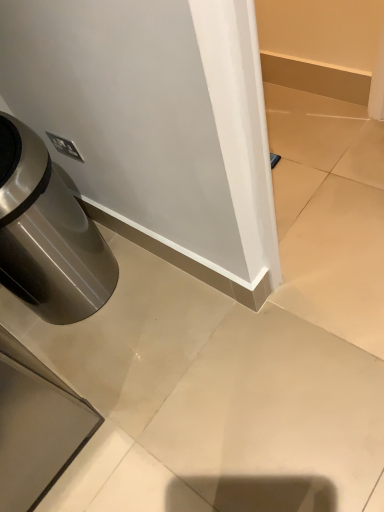
Image resolution: width=384 pixels, height=512 pixels. I want to click on white glossy baseboard at center, so click(275, 417).

What do you see at coordinates (275, 417) in the screenshot? I see `white glossy baseboard at center` at bounding box center [275, 417].

You are a GUI agent. You are given a task and a screenshot of the screen. Output one action in this format:
    pyautogui.click(x=<x>, y=<y>)
    Task: Click on the brushed metal trash can at lower left
    This screenshot has width=384, height=512.
    Given the screenshot: What is the action you would take?
    pyautogui.click(x=47, y=234)

The width and height of the screenshot is (384, 512). What do you see at coordinates (47, 234) in the screenshot?
I see `brushed metal trash can at lower left` at bounding box center [47, 234].

What is the approximate height of brushed metal trash can at lower left?

brushed metal trash can at lower left is 28.39 inches in height.

At what (x,y) coordinates should I click in order to perform the action: click on white glossy baseboard at center. Please return your answer as a coordinate pair (x, y). Looking at the image, I should click on (275, 417).

Which object is positioned more to the right, brushed metal trash can at lower left or white glossy baseboard at center?

white glossy baseboard at center is more to the right.

Is brushed metal trash can at lower left in front of or behind white glossy baseboard at center in the image?

Clearly, brushed metal trash can at lower left is behind white glossy baseboard at center.

Considering the points (98, 284) and (322, 490), which point is in front, point (98, 284) or point (322, 490)?

The point (322, 490) is closer to the camera.

From the image's perspective, which is above, brushed metal trash can at lower left or white glossy baseboard at center?

brushed metal trash can at lower left appears higher in the image.

From a real-world perspective, is brushed metal trash can at lower left physically below white glossy baseboard at center?

No, from a real-world perspective, brushed metal trash can at lower left is not below white glossy baseboard at center.

Considering the sizes of objects brushed metal trash can at lower left and white glossy baseboard at center in the image provided, who is wider, brushed metal trash can at lower left or white glossy baseboard at center?

white glossy baseboard at center is wider.

From the picture: Considering the sizes of brushed metal trash can at lower left and white glossy baseboard at center in the image, is brushed metal trash can at lower left taller or shorter than white glossy baseboard at center?

In the image, brushed metal trash can at lower left appears to be taller than white glossy baseboard at center.

In the scene shown: Does brushed metal trash can at lower left have a smaller size compared to white glossy baseboard at center?

No.

Is white glossy baseboard at center surrounded by brushed metal trash can at lower left?

Definitely not — white glossy baseboard at center is not inside brushed metal trash can at lower left.

Is the surface of brushed metal trash can at lower left in direct contact with white glossy baseboard at center?

They are not placed beside each other.

Is brushed metal trash can at lower left positioned with its back to white glossy baseboard at center?

brushed metal trash can at lower left is not turned away from white glossy baseboard at center.

What's the angular difference between brushed metal trash can at lower left and white glossy baseboard at center's facing directions?

There is a 180-degree angle between the facing directions of brushed metal trash can at lower left and white glossy baseboard at center.

You are a GUI agent. You are given a task and a screenshot of the screen. Output one action in this format:
    pyautogui.click(x=<x>, y=<y>)
    Task: Click on the concrete on the right of brushed metal trash can at lower left
    This screenshot has width=384, height=512.
    Given the screenshot: What is the action you would take?
    pyautogui.click(x=275, y=417)

Which is more to the left, white glossy baseboard at center or brushed metal trash can at lower left?

From the viewer's perspective, brushed metal trash can at lower left appears more on the left side.

Considering the relative positions of white glossy baseboard at center and brushed metal trash can at lower left in the image provided, is white glossy baseboard at center behind brushed metal trash can at lower left?

No.

Does point (366, 393) come closer to viewer compared to point (41, 274)?

Yes, point (366, 393) is closer to viewer.

From the image's perspective, would you say white glossy baseboard at center is shown under brushed metal trash can at lower left?

Yes, from the image's perspective, white glossy baseboard at center is below brushed metal trash can at lower left.

From a real-world perspective, who is located lower, white glossy baseboard at center or brushed metal trash can at lower left?

white glossy baseboard at center, from a real-world perspective.

Is white glossy baseboard at center wider than brushed metal trash can at lower left?

Yes.

Is white glossy baseboard at center taller or shorter than brushed metal trash can at lower left?

white glossy baseboard at center is shorter than brushed metal trash can at lower left.

Who is bigger, white glossy baseboard at center or brushed metal trash can at lower left?

Bigger between the two is brushed metal trash can at lower left.

Which is correct: white glossy baseboard at center is inside brushed metal trash can at lower left, or outside of it?

white glossy baseboard at center lies outside brushed metal trash can at lower left.

Are white glossy baseboard at center and brushed metal trash can at lower left far apart?

That's not correct — white glossy baseboard at center is a little close to brushed metal trash can at lower left.

Is white glossy baseboard at center oriented away from brushed metal trash can at lower left?

No, brushed metal trash can at lower left is not at the back of white glossy baseboard at center.

How different are the orientations of white glossy baseboard at center and brushed metal trash can at lower left in degrees?

white glossy baseboard at center and brushed metal trash can at lower left are facing 180 degrees away from each other.

At what (x,y) coordinates should I click in order to perform the action: click on waste container on the left side of white glossy baseboard at center. Please return your answer as a coordinate pair (x, y). Looking at the image, I should click on (47, 234).

Identify the location of waste container above the white glossy baseboard at center (from a real-world perspective). Image resolution: width=384 pixels, height=512 pixels. (47, 234).

The height and width of the screenshot is (512, 384). I want to click on concrete that is under the brushed metal trash can at lower left (from a real-world perspective), so click(x=275, y=417).